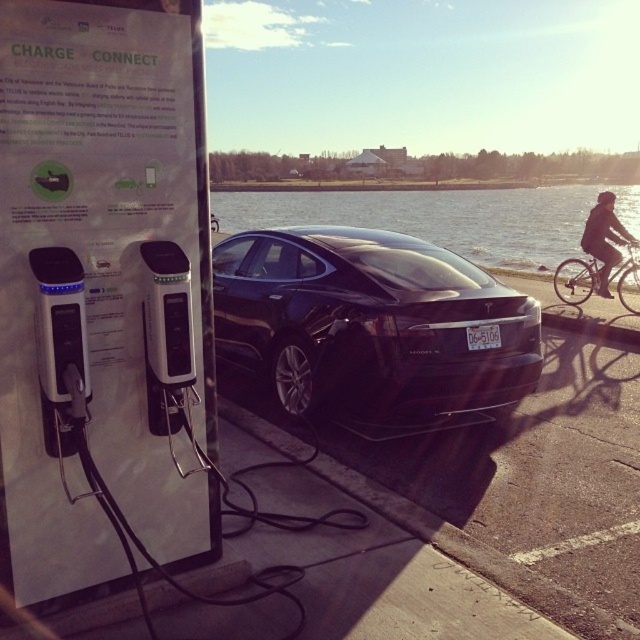
Question: Which object is positioned farthest from the black glossy sedan at center?

Choices:
 (A) transparent glass water at center
 (B) silver metallic bicycle at right

Answer: (A)

Question: Is transparent glass water at center smaller than dark fabric jacket at upper right?

Choices:
 (A) yes
 (B) no

Answer: (B)

Question: Which object appears farthest from the camera in this image?

Choices:
 (A) silver metallic bicycle at right
 (B) dark fabric jacket at upper right
 (C) black glossy sedan at center

Answer: (A)

Question: Is silver metallic bicycle at right in front of dark fabric jacket at upper right?

Choices:
 (A) yes
 (B) no

Answer: (B)

Question: Which point is farther to the camera?

Choices:
 (A) (458, 189)
 (B) (637, 248)

Answer: (A)

Question: Is transparent glass water at center wider than silver metallic bicycle at right?

Choices:
 (A) yes
 (B) no

Answer: (A)